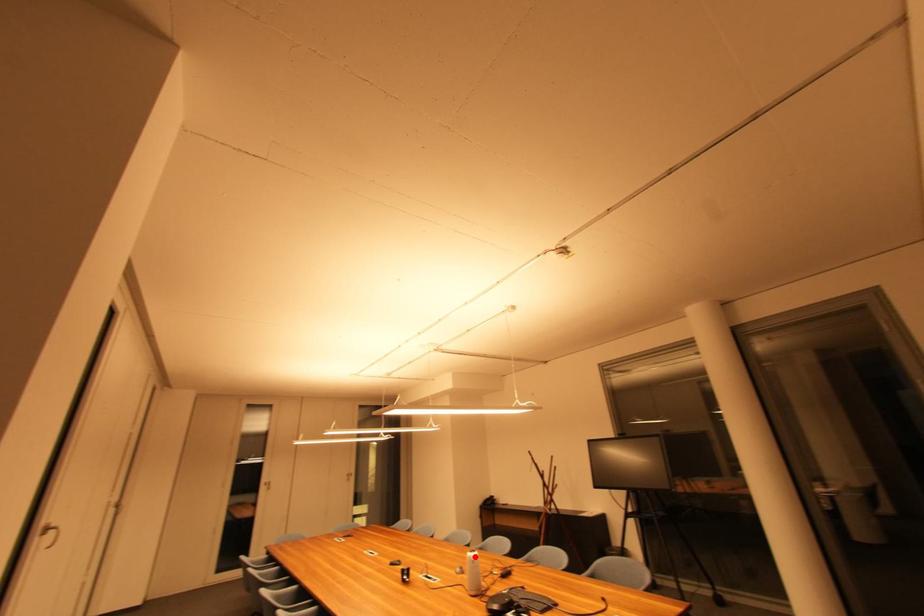
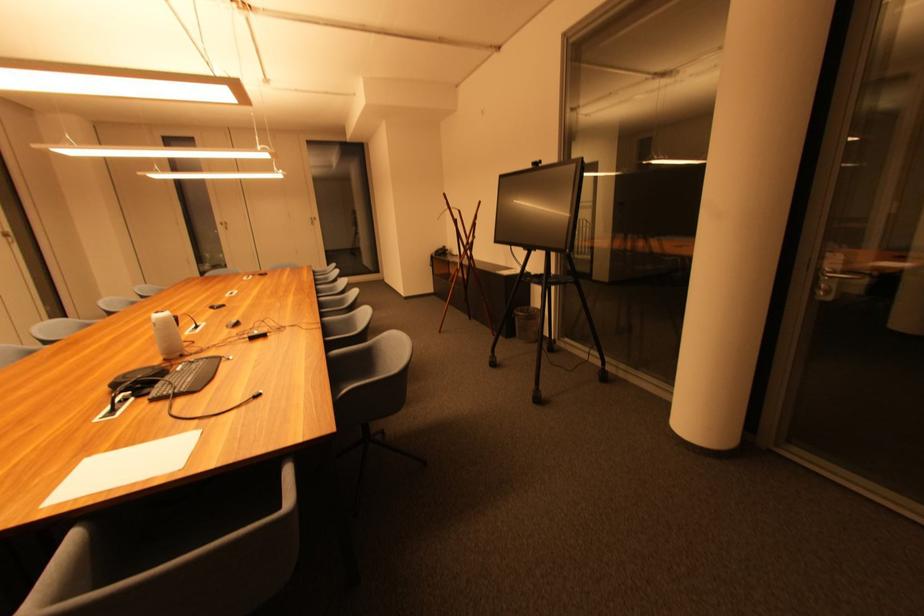
Question: I am providing you with two images of the same scene from different viewpoints. Given a red point in image1, look at the same physical point in image2. Is it:

Choices:
 (A) Closer to the viewpoint
 (B) Farther from the viewpoint

Answer: (B)